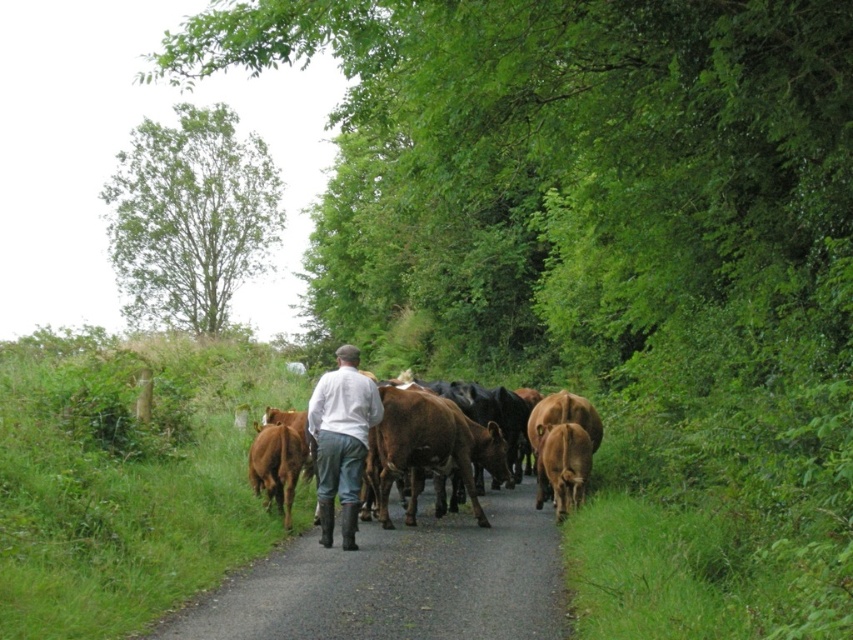
Question: Which point appears farthest from the camera in this image?

Choices:
 (A) (329, 538)
 (B) (332, 448)

Answer: (A)

Question: Can you confirm if brown glossy cows at center is positioned to the right of brown glossy cow at center?

Choices:
 (A) yes
 (B) no

Answer: (B)

Question: Which point is farther to the camera?

Choices:
 (A) brown glossy cows at center
 (B) green leafy tree at upper left

Answer: (B)

Question: Which object appears farthest from the camera in this image?

Choices:
 (A) green leafy tree at upper left
 (B) smooth asphalt road at center
 (C) white cotton shirt at center
 (D) brown glossy cow at center

Answer: (A)

Question: Can you confirm if green leafy tree at upper left is positioned to the left of brown glossy cows at center?

Choices:
 (A) no
 (B) yes

Answer: (B)

Question: Can you confirm if green leafy tree at upper left is thinner than brown glossy cow at center?

Choices:
 (A) yes
 (B) no

Answer: (B)